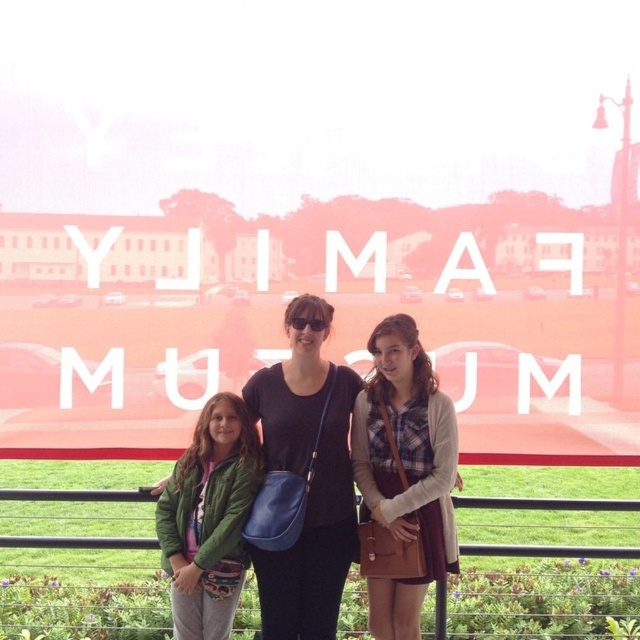
Question: Is plaid shirt at center wider than matte black top at center?

Choices:
 (A) yes
 (B) no

Answer: (B)

Question: Can you confirm if plaid shirt at center is wider than green fabric jacket at lower left?

Choices:
 (A) no
 (B) yes

Answer: (A)

Question: Which point is closer to the camera?

Choices:
 (A) (442, 452)
 (B) (230, 577)

Answer: (B)

Question: Among these points, which one is nearest to the camera?

Choices:
 (A) (323, 624)
 (B) (362, 560)
 (C) (244, 476)
 (D) (310, 296)

Answer: (B)

Question: Among these objects, which one is nearest to the camera?

Choices:
 (A) green fabric jacket at lower left
 (B) plaid shirt at center

Answer: (B)

Question: Does plaid shirt at center appear under matte black shirt at center?

Choices:
 (A) yes
 (B) no

Answer: (A)